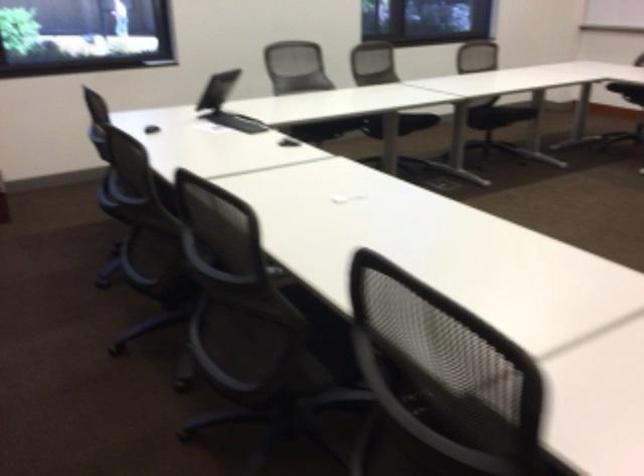
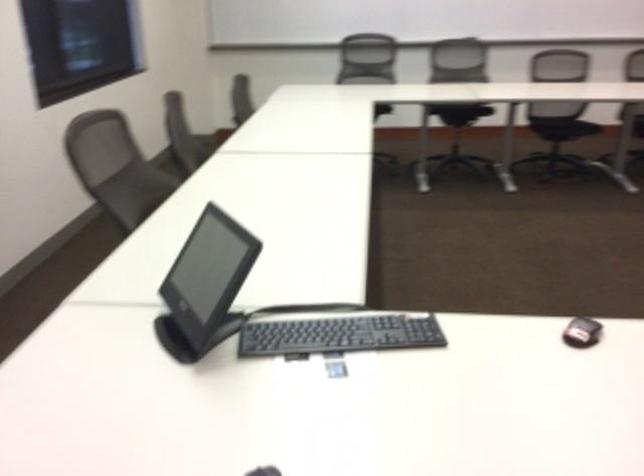
Question: In a continuous first-person perspective shot, in which direction is the camera moving?

Choices:
 (A) Left
 (B) Right
 (C) Forward
 (D) Backward

Answer: (D)